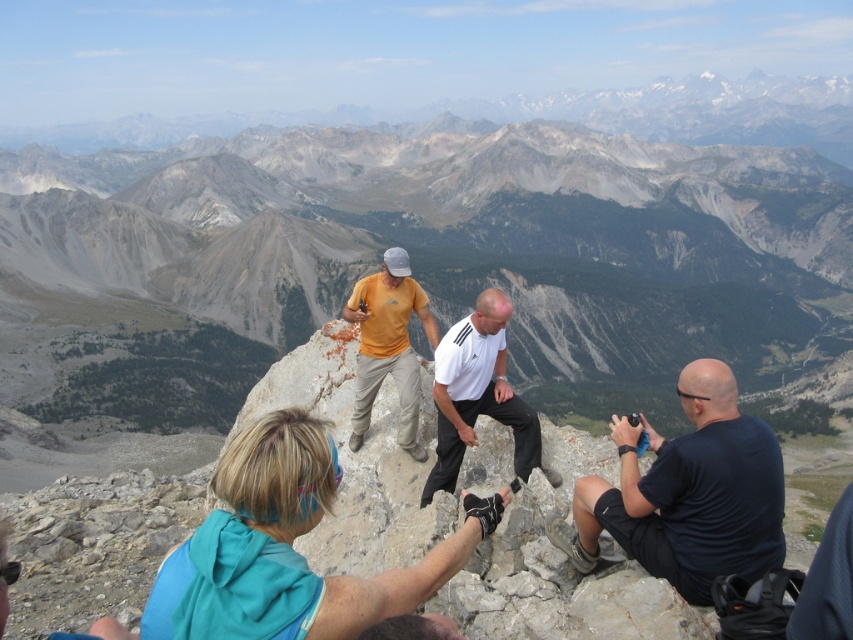
Can you confirm if white matte shirt at center is taller than yellow matte shirt at center?

No, white matte shirt at center is not taller than yellow matte shirt at center.

Who is taller, white matte shirt at center or yellow matte shirt at center?

With more height is yellow matte shirt at center.

Which is behind, point (496, 388) or point (363, 353)?

The point (363, 353) is more distant.

The width and height of the screenshot is (853, 640). Find the location of `white matte shirt at center`. white matte shirt at center is located at coordinates (477, 394).

Looking at this image, is blue fabric at center in front of white matte shirt at center?

Yes, blue fabric at center is closer to the viewer.

Which is more to the left, blue fabric at center or white matte shirt at center?

From the viewer's perspective, blue fabric at center appears more on the left side.

The width and height of the screenshot is (853, 640). What are the coordinates of `blue fabric at center` in the screenshot? It's located at (286, 548).

Is point (723, 556) positioned in front of point (473, 384)?

Yes.

From the picture: Is dark blue shirt at right shorter than white matte shirt at center?

Yes, dark blue shirt at right is shorter than white matte shirt at center.

Is point (692, 508) positioned in front of point (505, 364)?

Yes.

Image resolution: width=853 pixels, height=640 pixels. In order to click on dark blue shirt at right in this screenshot , I will do `click(688, 493)`.